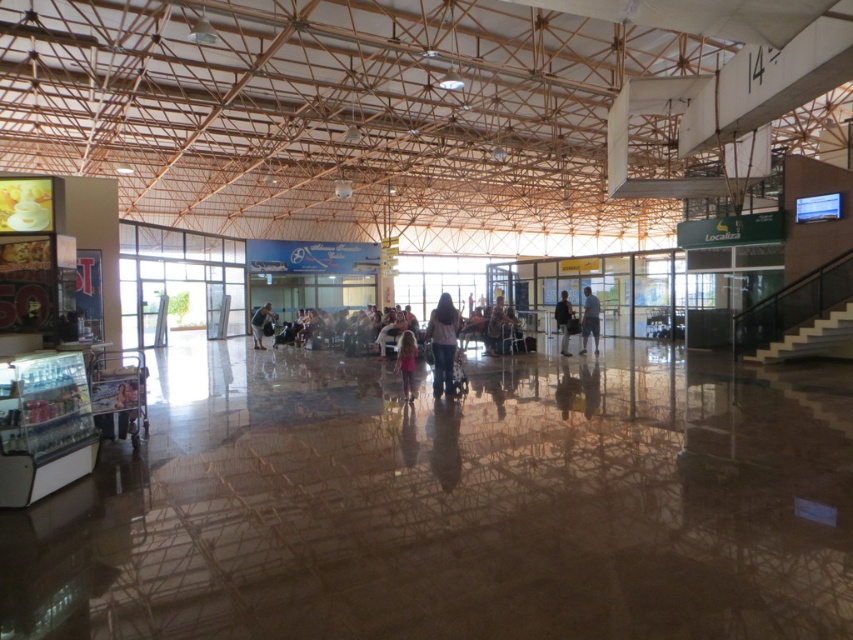
Question: Estimate the real-world distances between objects in this image. Which object is farther from the light blue jeans at center?

Choices:
 (A) dark blue jacket at center
 (B) matte black backpack at center
 (C) light pink fabric dress at center

Answer: (B)

Question: In this image, where is pink fabric dress at center located relative to light blue jeans at center?

Choices:
 (A) above
 (B) below

Answer: (B)

Question: Where is light pink fabric dress at center located in relation to light blue jeans at center in the image?

Choices:
 (A) below
 (B) above

Answer: (B)

Question: Which of the following is the closest to the observer?

Choices:
 (A) (407, 364)
 (B) (564, 316)
 (C) (583, 339)
 (D) (253, 323)

Answer: (A)

Question: Can you confirm if light blue jeans at center is wider than dark blue jacket at center?

Choices:
 (A) yes
 (B) no

Answer: (B)

Question: Among these objects, which one is nearest to the camera?

Choices:
 (A) pink fabric dress at center
 (B) light pink fabric dress at center
 (C) matte black backpack at center

Answer: (B)